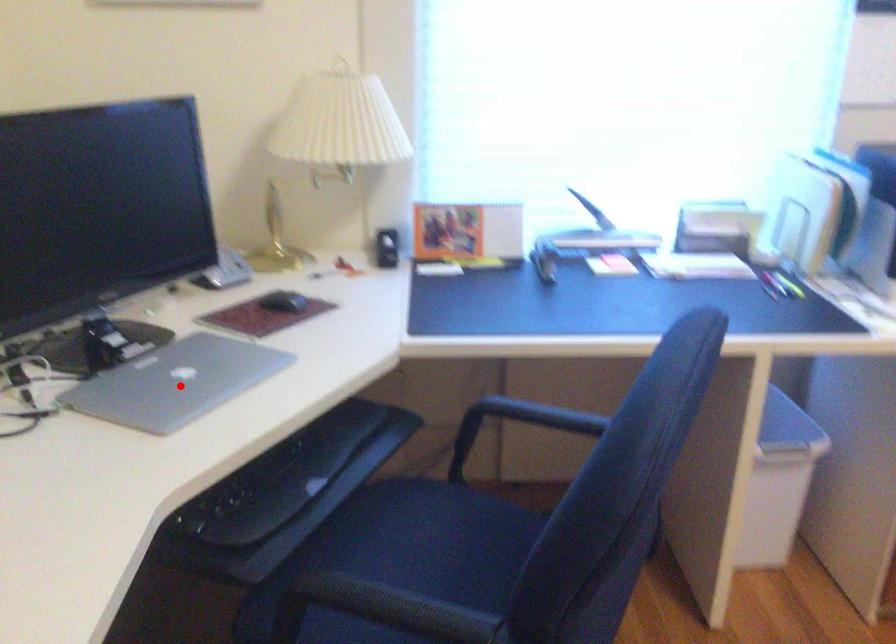
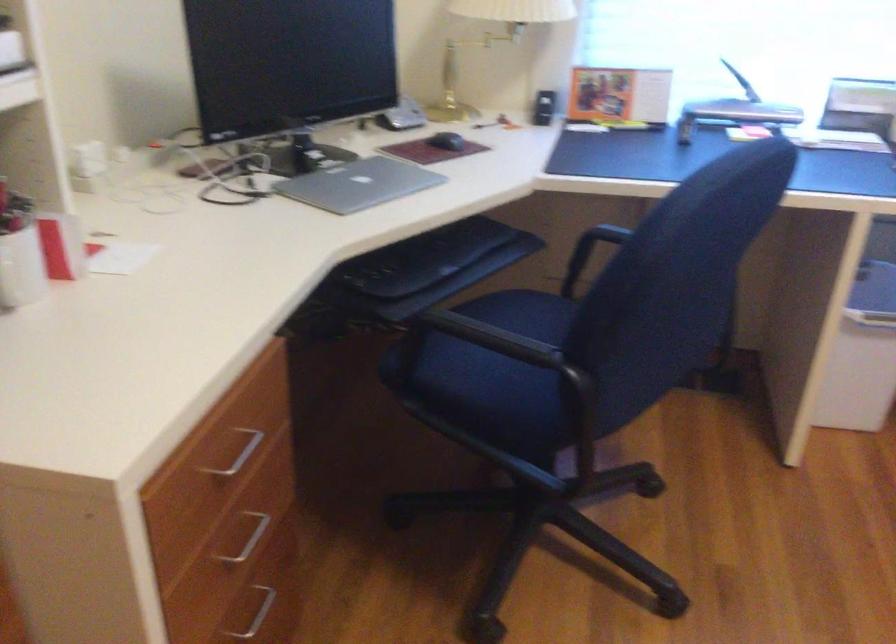
Question: I am providing you with two images of the same scene from different viewpoints. Given a red point in image1, look at the same physical point in image2. Is it:

Choices:
 (A) Closer to the viewpoint
 (B) Farther from the viewpoint

Answer: (B)